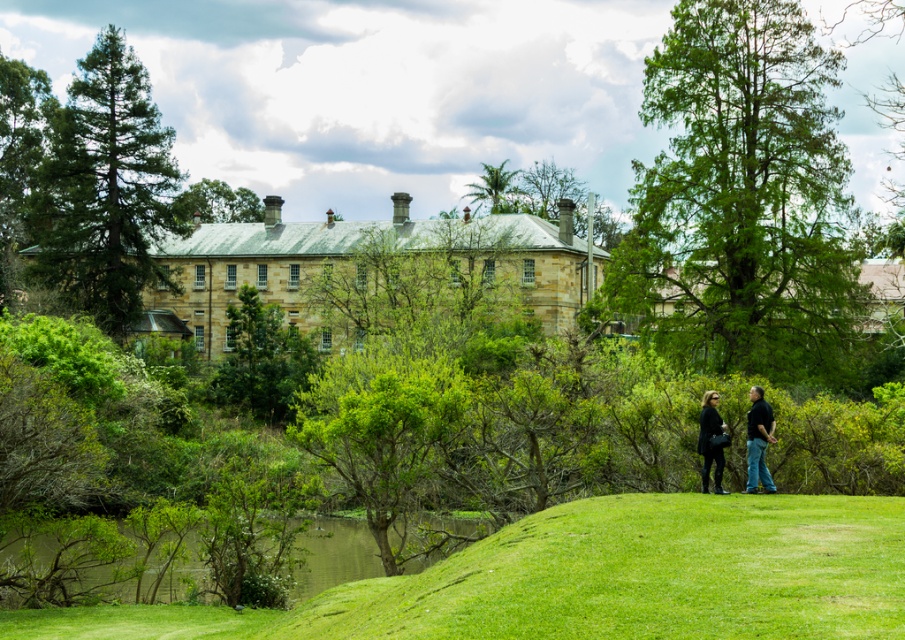
Can you confirm if green leafy tree at upper right is positioned above green leafy tree at left?

No.

Does green leafy tree at upper right have a greater height compared to green leafy tree at left?

No.

Describe the element at coordinates (742, 198) in the screenshot. I see `green leafy tree at upper right` at that location.

The image size is (905, 640). I want to click on green leafy tree at upper right, so click(742, 198).

Does green leafy tree at upper left have a lesser height compared to matte black jacket at lower center?

Incorrect, green leafy tree at upper left's height does not fall short of matte black jacket at lower center's.

Where is `green leafy tree at upper left`? This screenshot has height=640, width=905. green leafy tree at upper left is located at coordinates [x=103, y=188].

Who is taller, matte black pants at lower center or matte black jacket at lower center?

matte black pants at lower center is taller.

Who is lower down, matte black pants at lower center or matte black jacket at lower center?

matte black jacket at lower center is below.

Is point (765, 413) positioned behind point (703, 397)?

No.

You are a GUI agent. You are given a task and a screenshot of the screen. Output one action in this format:
    pyautogui.click(x=<x>, y=<y>)
    Task: Click on the matte black pants at lower center
    The image size is (905, 640).
    Given the screenshot: What is the action you would take?
    pyautogui.click(x=758, y=442)